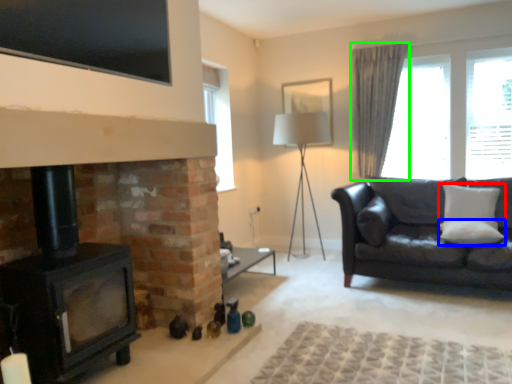
Question: Estimate the real-world distances between objects in this image. Which object is farther from pillow (highlighted by a red box), pillow (highlighted by a blue box) or curtain (highlighted by a green box)?

Choices:
 (A) pillow
 (B) curtain

Answer: (B)